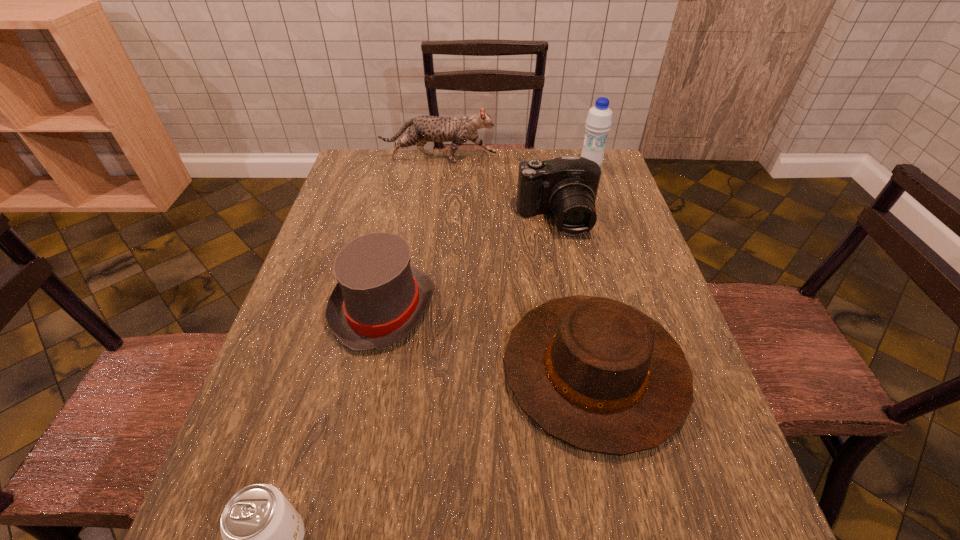
The width and height of the screenshot is (960, 540). What are the coordinates of `water bottle` in the screenshot? It's located at (599, 119).

Find the location of a particular element. This screenshot has width=960, height=540. cat is located at coordinates (422, 129).

At what (x,y) coordinates should I click in order to perform the action: click on camera. Please return your answer as a coordinate pair (x, y). The image size is (960, 540). Looking at the image, I should click on (567, 186).

Locate an element on the screen. Image resolution: width=960 pixels, height=540 pixels. dress hat is located at coordinates (379, 298).

Where is `cowboy hat`? The width and height of the screenshot is (960, 540). cowboy hat is located at coordinates (597, 374).

This screenshot has width=960, height=540. I want to click on vacant space located 0.360m on the front of the water bottle, so click(616, 246).

Locate an element on the screen. This screenshot has width=960, height=540. vacant space located 0.240m on the face of the cat is located at coordinates (567, 159).

Where is `vacant region located 0.290m on the lens of the camera`? The width and height of the screenshot is (960, 540). vacant region located 0.290m on the lens of the camera is located at coordinates (577, 322).

Find the location of a particular element. Image resolution: width=960 pixels, height=540 pixels. vacant point located 0.180m on the right of the dress hat is located at coordinates (511, 308).

Locate an element on the screen. Image resolution: width=960 pixels, height=540 pixels. vacant position located 0.300m on the back of the cowboy hat is located at coordinates (564, 224).